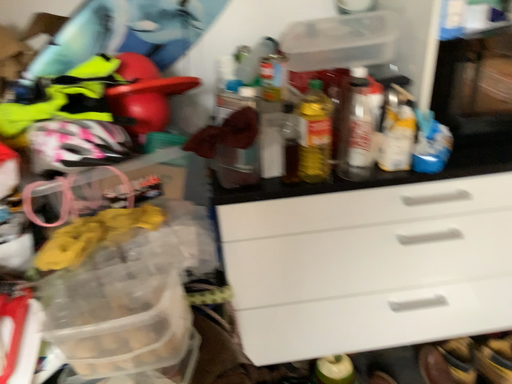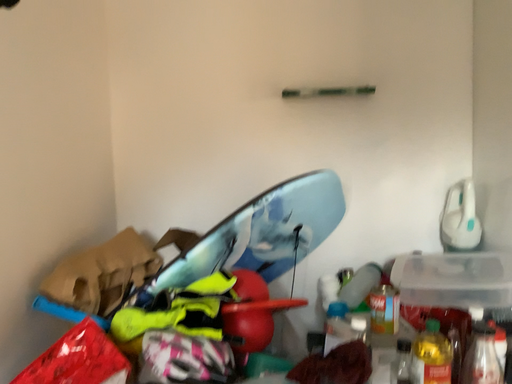
Question: How did the camera likely rotate when shooting the video?

Choices:
 (A) rotated left
 (B) rotated right

Answer: (A)